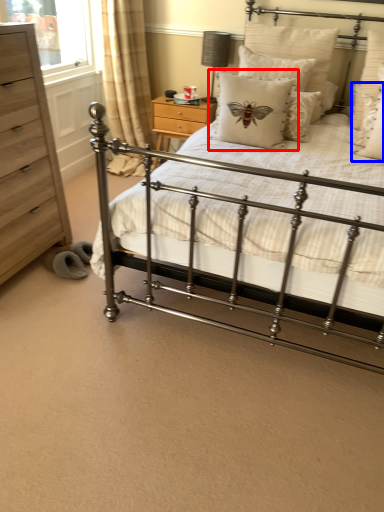
Question: Which object appears closest to the camera in this image, pillow (highlighted by a red box) or pillow (highlighted by a blue box)?

Choices:
 (A) pillow
 (B) pillow

Answer: (B)